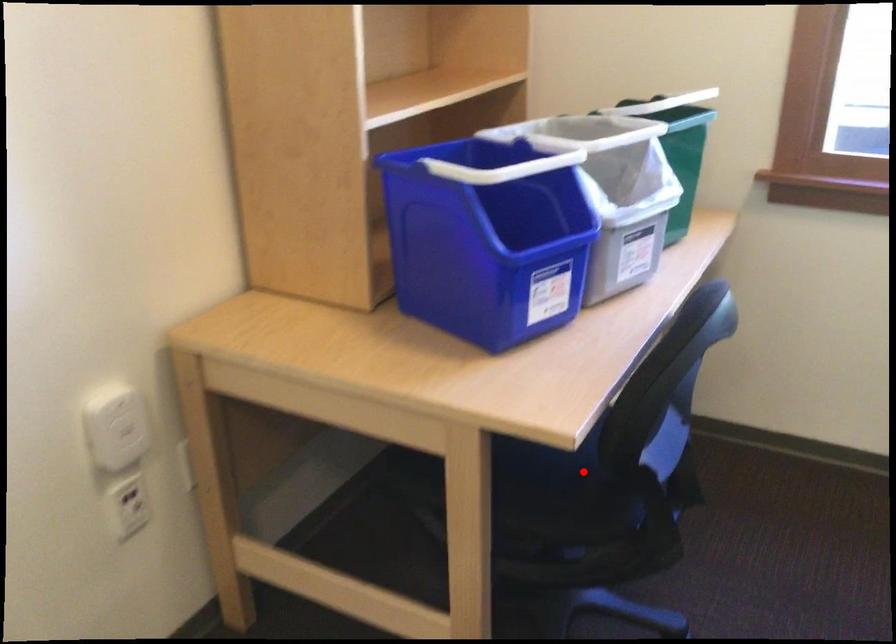
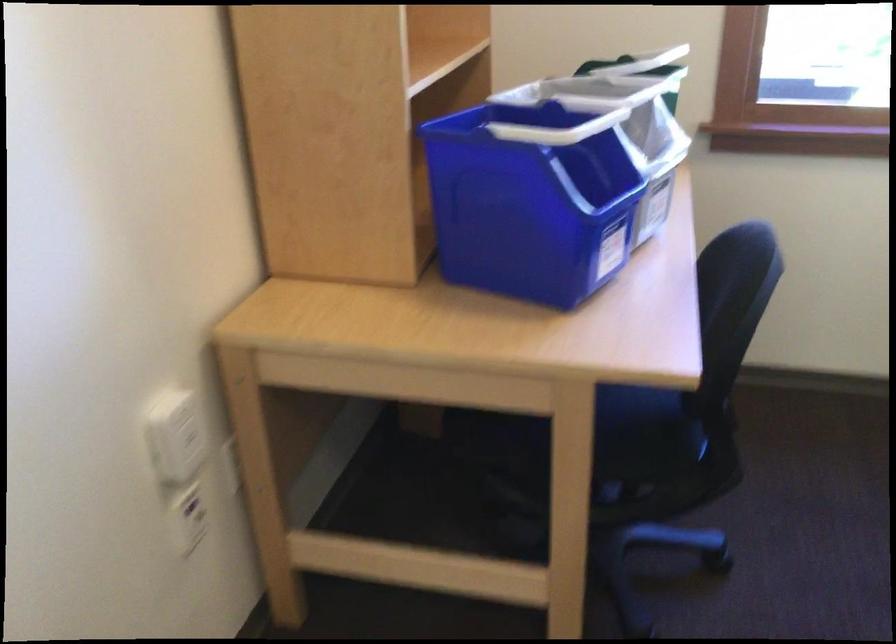
Where in the second image is the point corresponding to the highlighted location from the first image?

(633, 415)